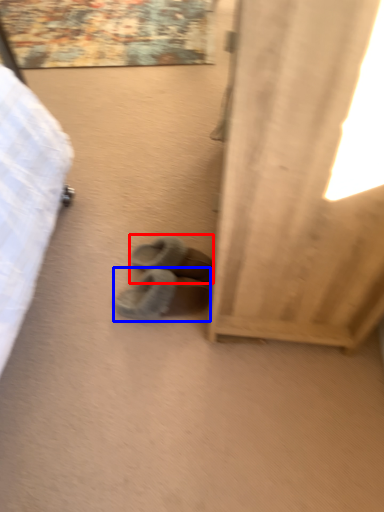
Question: Which point is further to the camera, footwear (highlighted by a red box) or footwear (highlighted by a blue box)?

Choices:
 (A) footwear
 (B) footwear

Answer: (A)